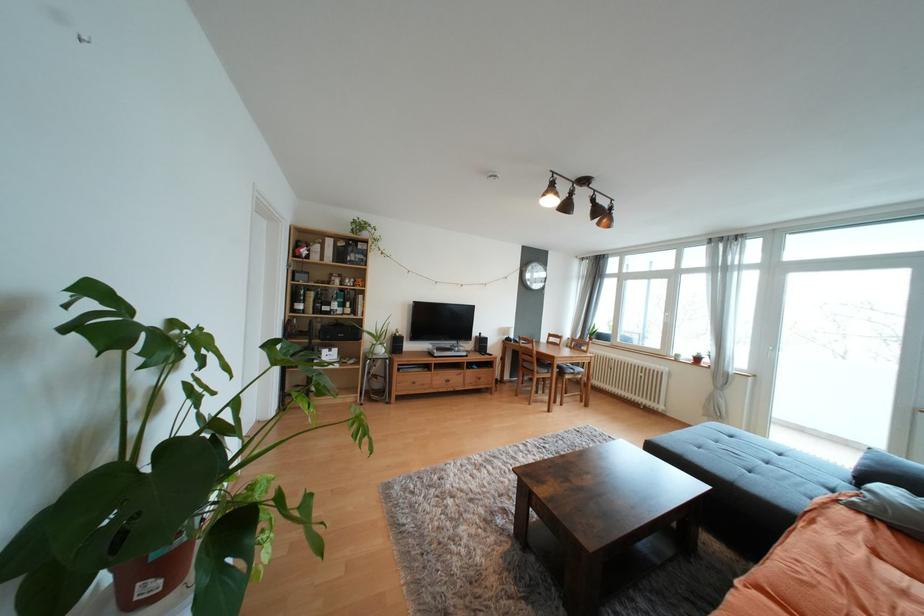
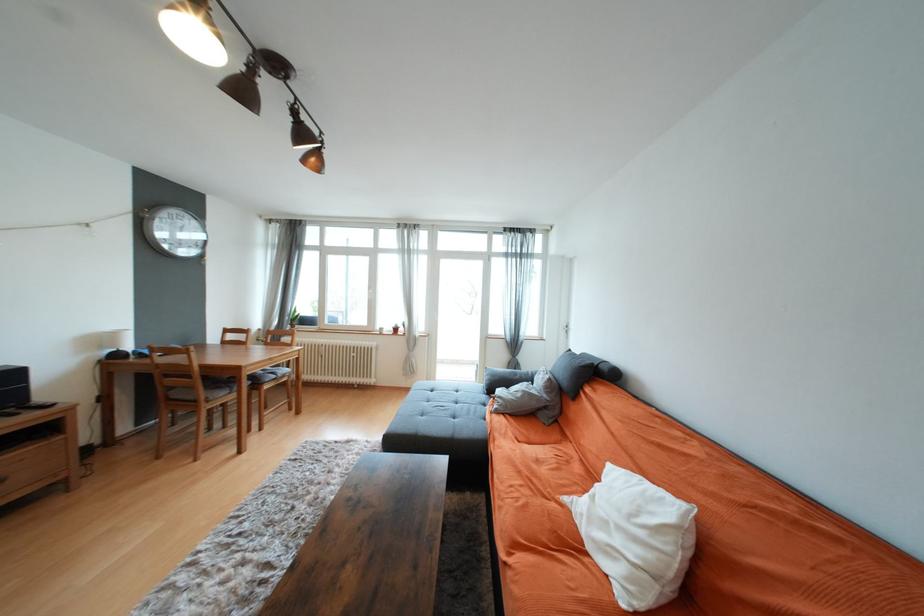
Question: The camera is either moving clockwise (left) or counter-clockwise (right) around the object. The first image is from the beginning of the video and the second image is from the end. Is the camera moving left or right when shooting the video?

Choices:
 (A) Left
 (B) Right

Answer: (A)